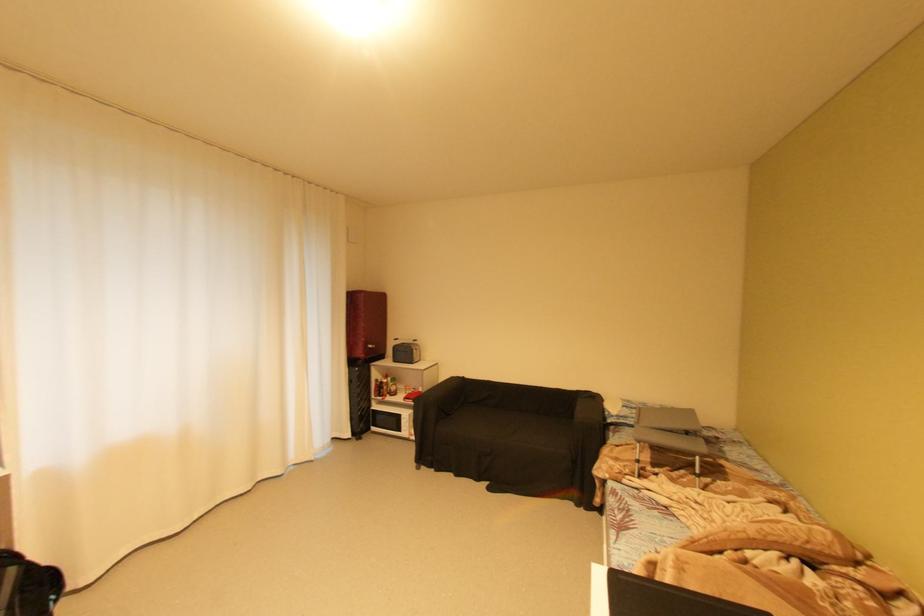
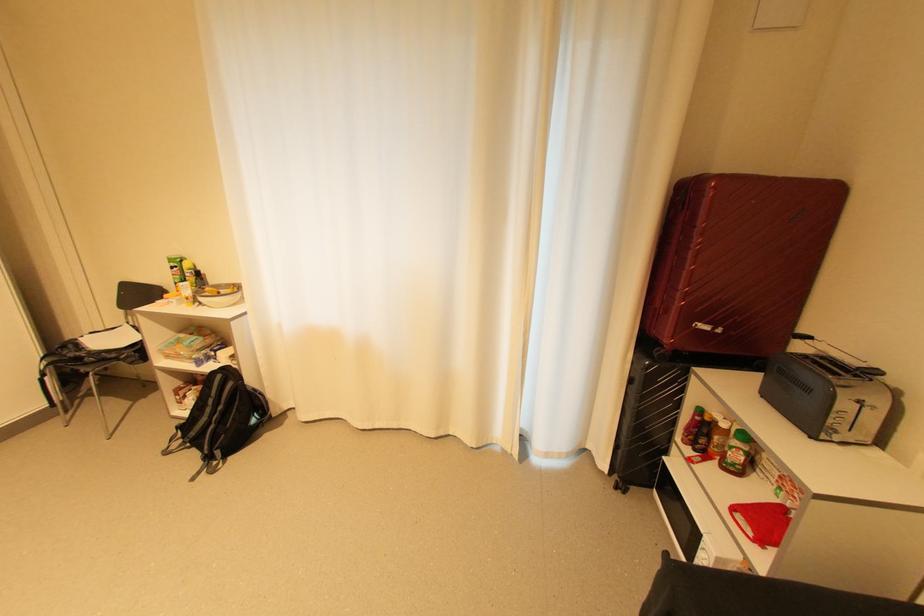
Where in the second image is the point corresponding to point (378, 346) from the first image?

(713, 328)